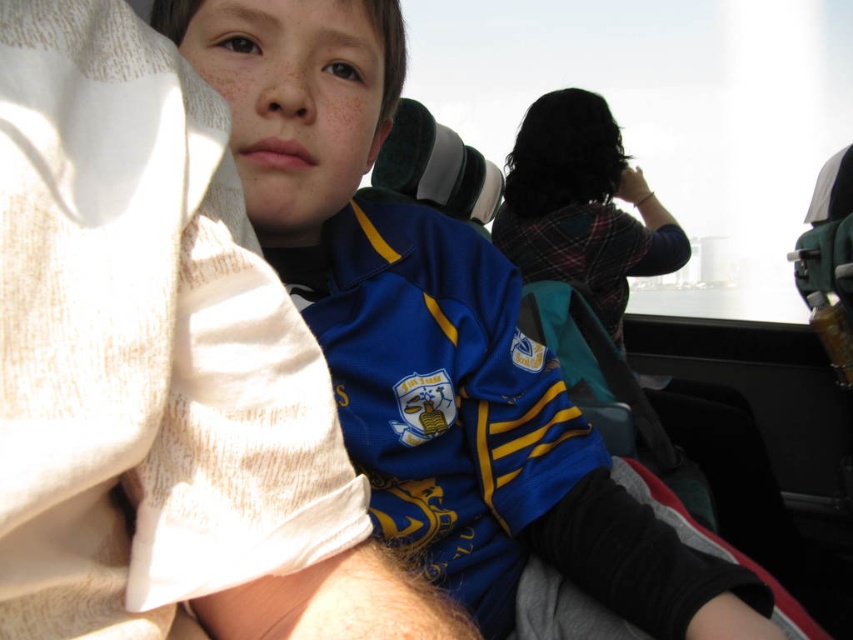
What are the coordinates of the blue jersey at upper left?

The blue jersey at upper left is located at coordinates point (x=160, y=369).

You are sitting in a vehicle and want to know which point is closer to you. Given the two points in the image, point (28, 502) and point (486, 282), can you determine which one is closer based on their positions?

Point (28, 502) is in front of point (486, 282), so it is closer to you.

You are a photographer trying to capture a photo of the blue jersey at upper left and the blue jersey at center. The minimum distance your camera can focus on two objects is 30 centimeters. Can both blue jerseys be in focus at the same time?

The blue jersey at upper left is 32.29 centimeters from blue jersey at center. Since the distance between them is greater than 30 centimeters, the camera cannot focus on both at the same time.